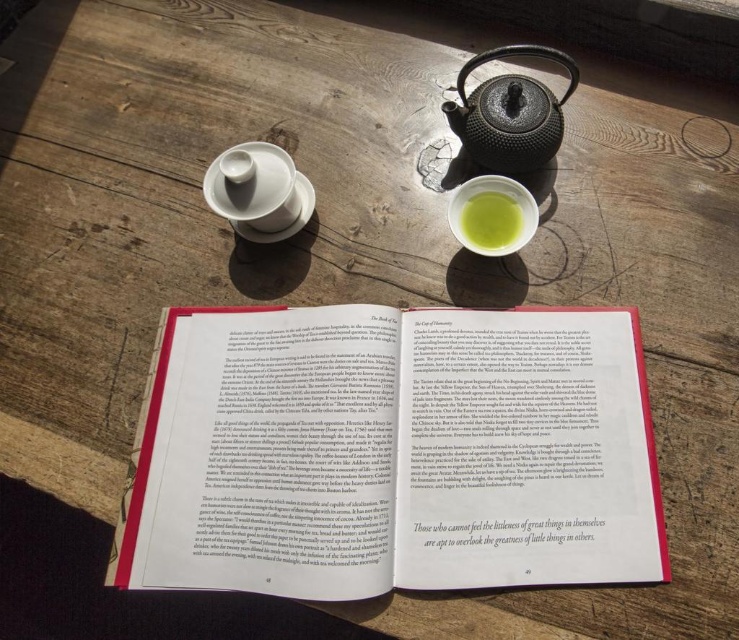
You are a guest at a tea ceremony and see the matte green porcelain cup at center and the green matte bowl at center on the table. Which object is positioned higher relative to the other?

The matte green porcelain cup at center is located above the green matte bowl at center.

You are standing at the edge of the table looking towards the center. Which of the two points, point (x=514, y=202) or point (x=466, y=241), is closer to you?

Point (x=466, y=241) is closer to you because it is in front of point (x=514, y=202).

You are a barista preparing a drink and need to place both the matte green porcelain cup at center and the green matte bowl at center on the table without them touching. Given the current spacing between them, is this requirement already met?

The distance between the matte green porcelain cup at center and the green matte bowl at center is 0.33 inches, which means they are already not touching. Therefore, the requirement is already satisfied.